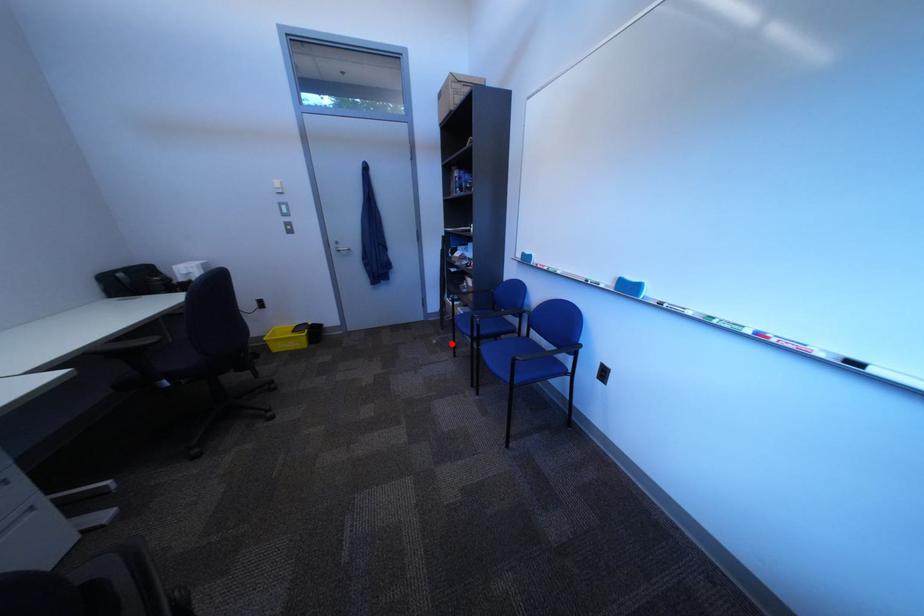
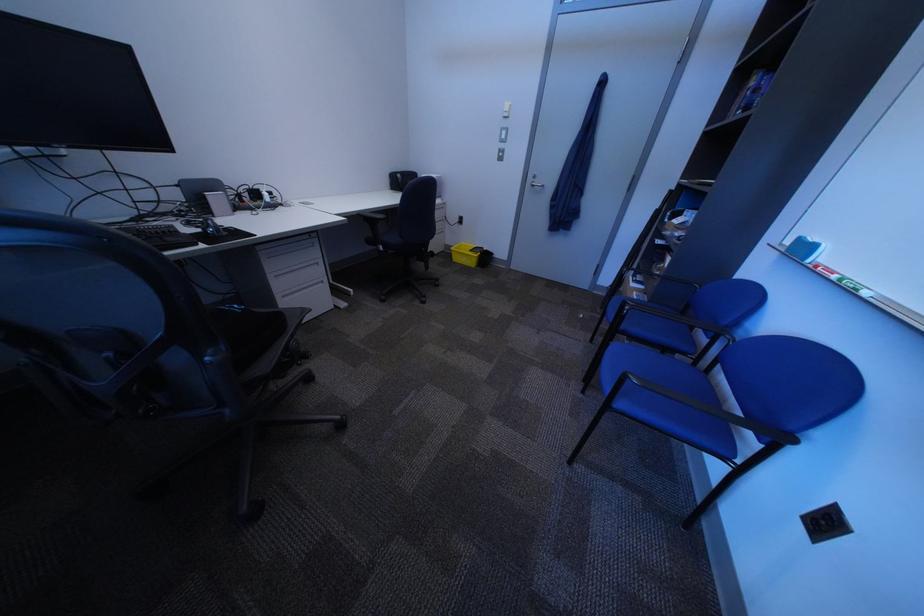
Question: I am providing you with two images of the same scene from different viewpoints. A red point is shown in image1. For the corresponding object point in image2, is it positioned nearer or farther from the camera?

Choices:
 (A) Nearer
 (B) Farther

Answer: (A)